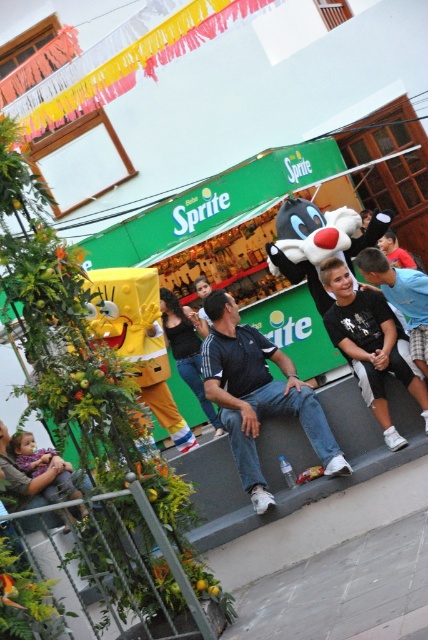
Question: Based on their relative distances, which object is nearer to the dark blue shirt at center?

Choices:
 (A) black matte skateboard at center
 (B) plush purple dress at lower left

Answer: (A)

Question: Does dark blue shirt at center have a lesser width compared to plush purple dress at lower left?

Choices:
 (A) yes
 (B) no

Answer: (B)

Question: Which object is farther from the camera taking this photo?

Choices:
 (A) dark blue shirt at center
 (B) black matte skateboard at center
 (C) plush purple dress at lower left

Answer: (C)

Question: Which point appears farthest from the camera in this image?

Choices:
 (A) (2, 468)
 (B) (228, 410)
 (C) (354, 332)

Answer: (A)

Question: Can you confirm if black matte skateboard at center is positioned below plush purple dress at lower left?

Choices:
 (A) no
 (B) yes

Answer: (A)

Question: Where is dark blue shirt at center located in relation to plush purple dress at lower left in the image?

Choices:
 (A) right
 (B) left

Answer: (A)